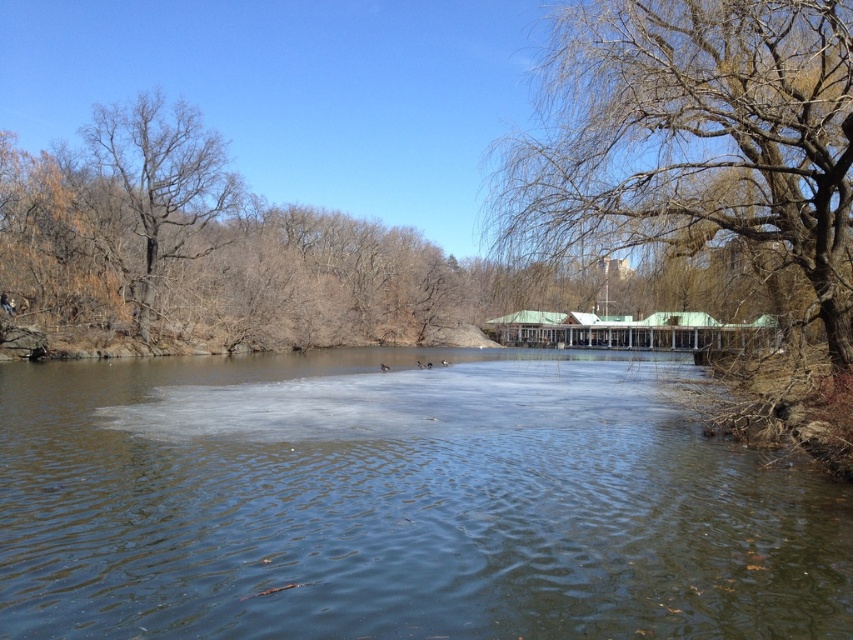
Question: Is bare branches at upper right above bare branches at left?

Choices:
 (A) yes
 (B) no

Answer: (B)

Question: Does clear water at center appear over bare branches at left?

Choices:
 (A) yes
 (B) no

Answer: (B)

Question: Is bare branches at upper right to the left of bare branches at left from the viewer's perspective?

Choices:
 (A) yes
 (B) no

Answer: (B)

Question: Which of the following is the farthest from the observer?

Choices:
 (A) click(x=711, y=147)
 (B) click(x=129, y=108)
 (C) click(x=630, y=497)

Answer: (B)

Question: Among these points, which one is nearest to the camera?

Choices:
 (A) (692, 56)
 (B) (387, 605)

Answer: (B)

Question: Which point is farther to the camera?

Choices:
 (A) (581, 108)
 (B) (206, 241)

Answer: (B)